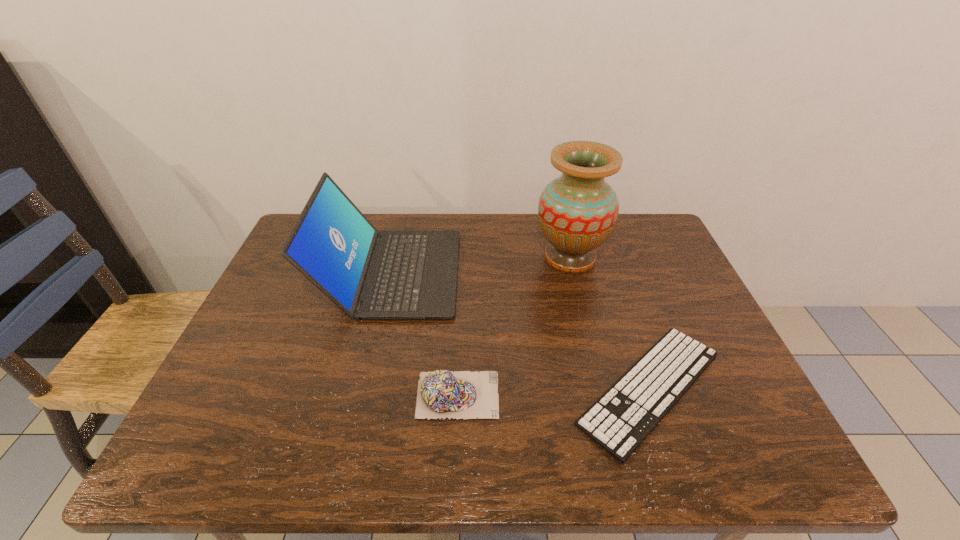
This screenshot has width=960, height=540. In order to click on object situated at the near edge in this screenshot , I will do `click(619, 421)`.

Where is `object at the left edge`? object at the left edge is located at coordinates (368, 274).

Image resolution: width=960 pixels, height=540 pixels. What are the coordinates of `object present at the right edge` in the screenshot? It's located at (619, 421).

Locate an element on the screen. The image size is (960, 540). object that is positioned at the far left corner is located at coordinates (368, 274).

Image resolution: width=960 pixels, height=540 pixels. I want to click on object that is positioned at the near right corner, so click(619, 421).

Where is `vacant space at the far edge of the desktop`? vacant space at the far edge of the desktop is located at coordinates (440, 215).

This screenshot has width=960, height=540. I want to click on vacant space at the near edge, so click(530, 446).

The image size is (960, 540). In the image, there is a desktop. Find the location of `free space at the left edge`. free space at the left edge is located at coordinates (199, 418).

This screenshot has width=960, height=540. I want to click on vacant space at the right edge, so click(660, 305).

This screenshot has width=960, height=540. Find the location of `vacant space at the far right corner of the desktop`. vacant space at the far right corner of the desktop is located at coordinates (650, 249).